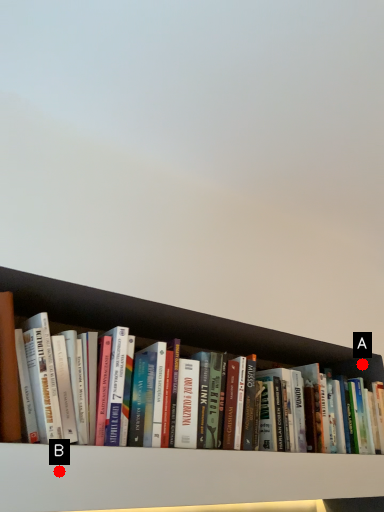
Question: Two points are circled on the image, labeled by A and B beside each circle. Which point appears farthest from the camera in this image?

Choices:
 (A) A is further
 (B) B is further

Answer: (A)